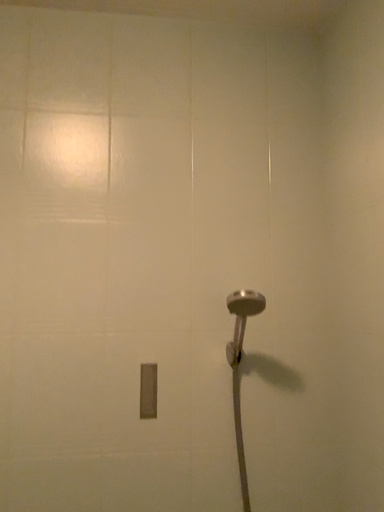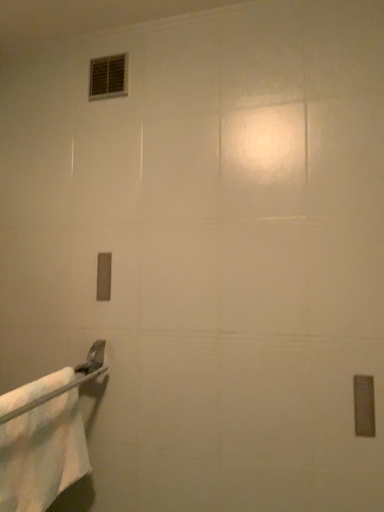
Question: How did the camera likely rotate when shooting the video?

Choices:
 (A) rotated right
 (B) rotated left

Answer: (B)